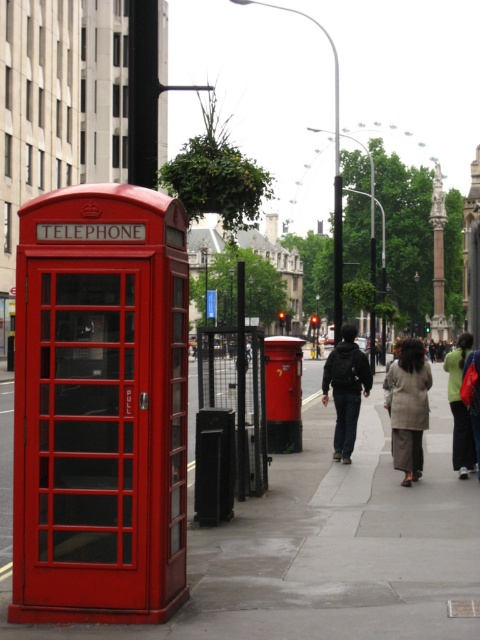
You are standing in the middle of the street in this image. There is a point marked at coordinates (99, 406). Which object does this point belong to?

The point at coordinates (99, 406) is on the matte red telephone at left.

You are a delivery person carrying a large box and need to place it on the smooth concrete sidewalk at center. You are currently holding the dark gray fabric jacket at center. Can you safely place the box on the sidewalk without dropping the jacket?

The smooth concrete sidewalk at center is 3.68 meters away from the dark gray fabric jacket at center. Since the jacket is being held by you, you can safely place the box on the sidewalk without dropping the jacket as they are separate objects and the distance allows for safe placement.